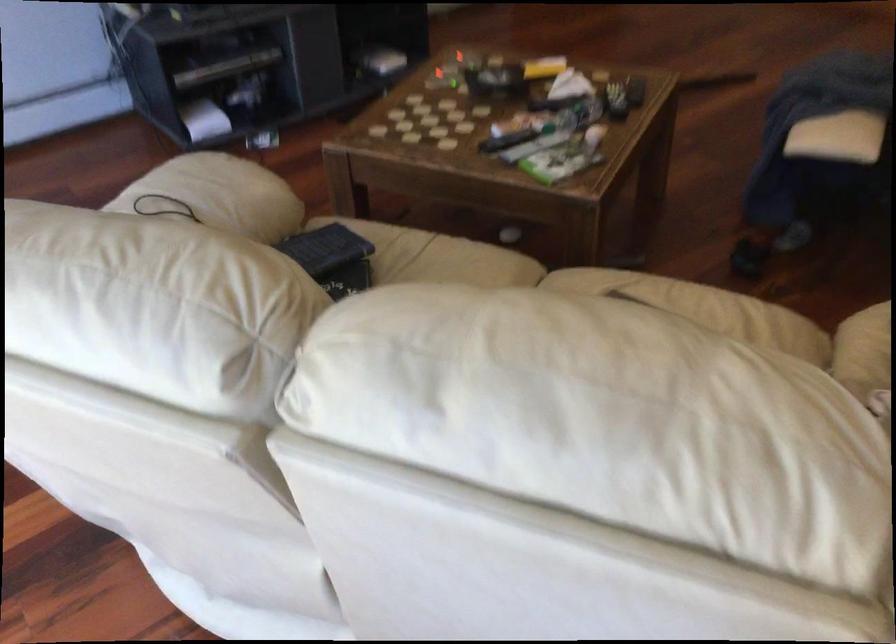
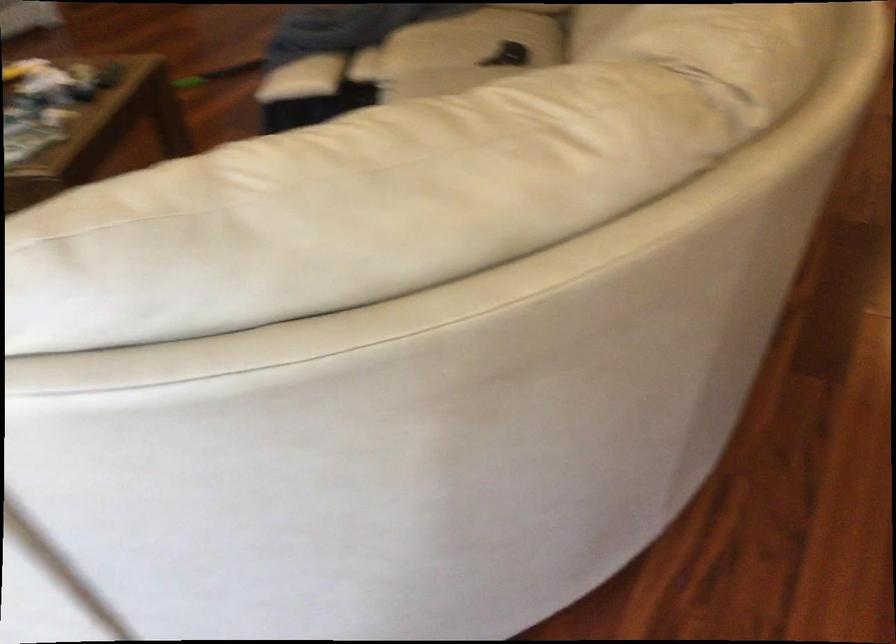
Question: How did the camera likely rotate?

Choices:
 (A) Left
 (B) Right
 (C) Up
 (D) Down

Answer: (B)